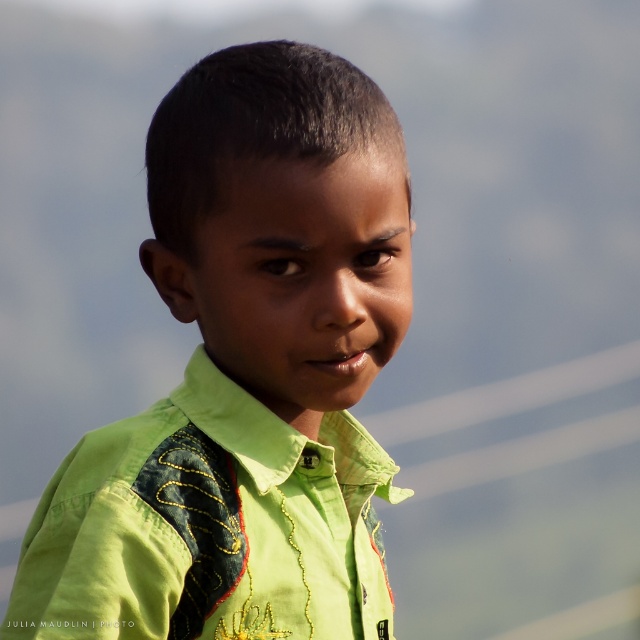
You are a tailor who needs to determine which part of the boy is closer to the camera. The scene shows a green fabric shirt at center and a green embroidered shirt at center. Which one is taller?

The green fabric shirt at center is taller than the green embroidered shirt at center, so the green fabric shirt at center is closer to the camera.

You are a photographer adjusting the focus of your camera. The camera is currently focused on the point at coordinates point (244, 374). Based on the scene, what object is the camera focused on?

The point (244, 374) indicates green fabric shirt at center, so the camera is focused on the green fabric shirt at center.